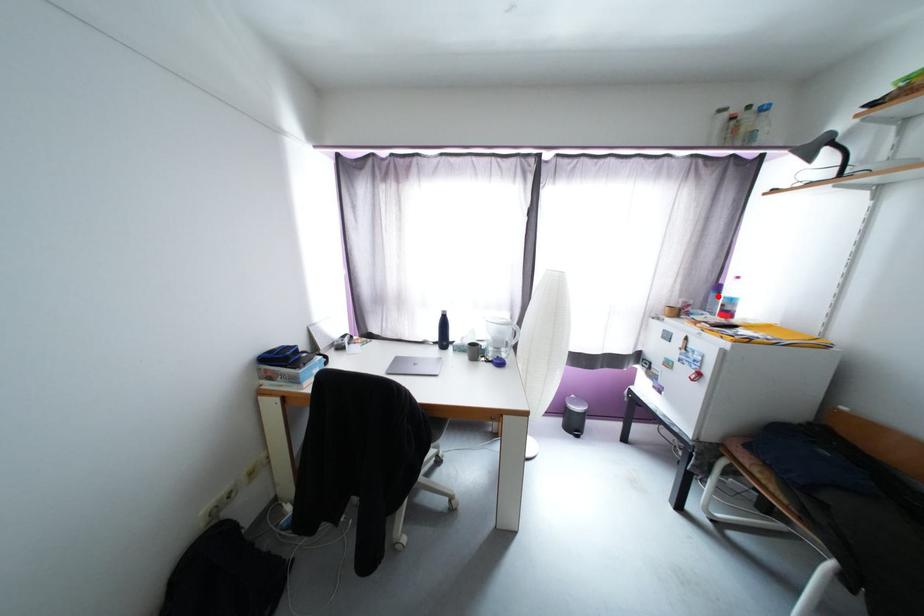
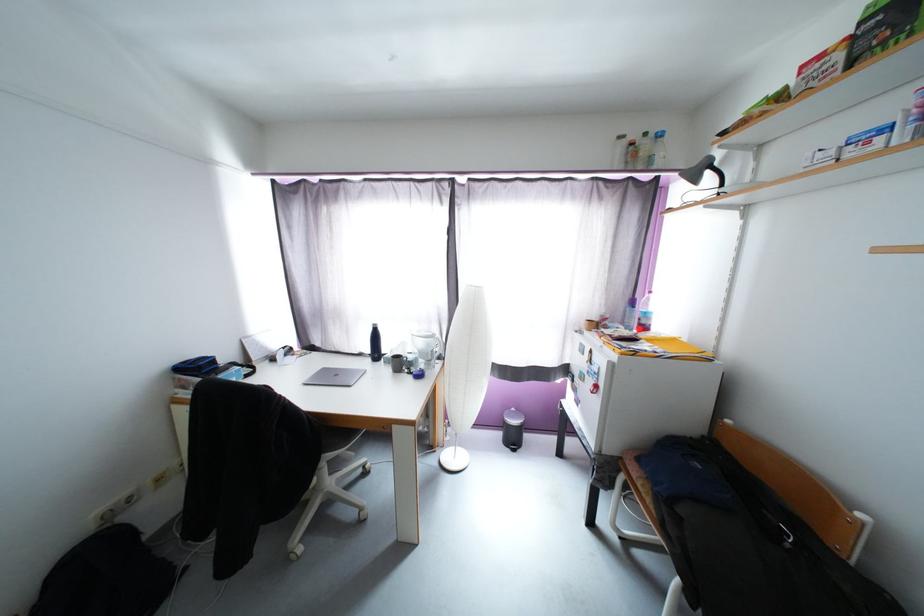
In the second image, find the point that corresponds to the highlighted location in the first image.

(634, 310)